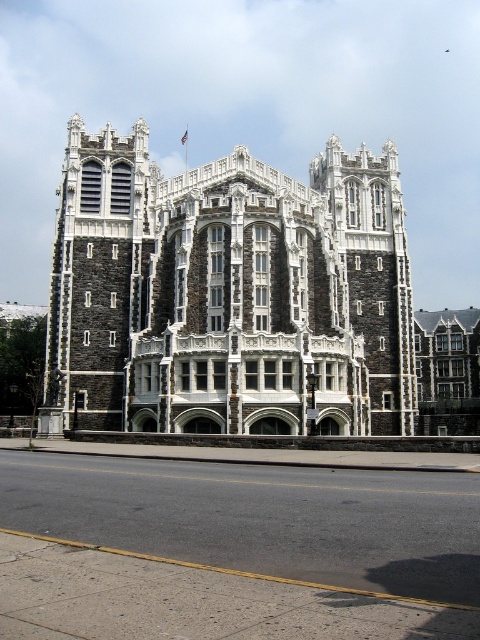
Question: Observing the image, what is the correct spatial positioning of stone/brick church at center in reference to dark gray stone tower at left?

Choices:
 (A) right
 (B) left

Answer: (A)

Question: Is stone/brick church at center smaller than dark gray stone tower at left?

Choices:
 (A) yes
 (B) no

Answer: (B)

Question: Which point appears closest to the camera in this image?

Choices:
 (A) (126, 340)
 (B) (292, 269)

Answer: (B)

Question: Among these points, which one is farthest from the camera?

Choices:
 (A) (315, 385)
 (B) (64, 170)

Answer: (B)

Question: Can you confirm if stone/brick church at center is thinner than dark gray stone tower at left?

Choices:
 (A) no
 (B) yes

Answer: (A)

Question: Which point is closer to the camera?

Choices:
 (A) click(x=336, y=232)
 (B) click(x=99, y=266)

Answer: (B)